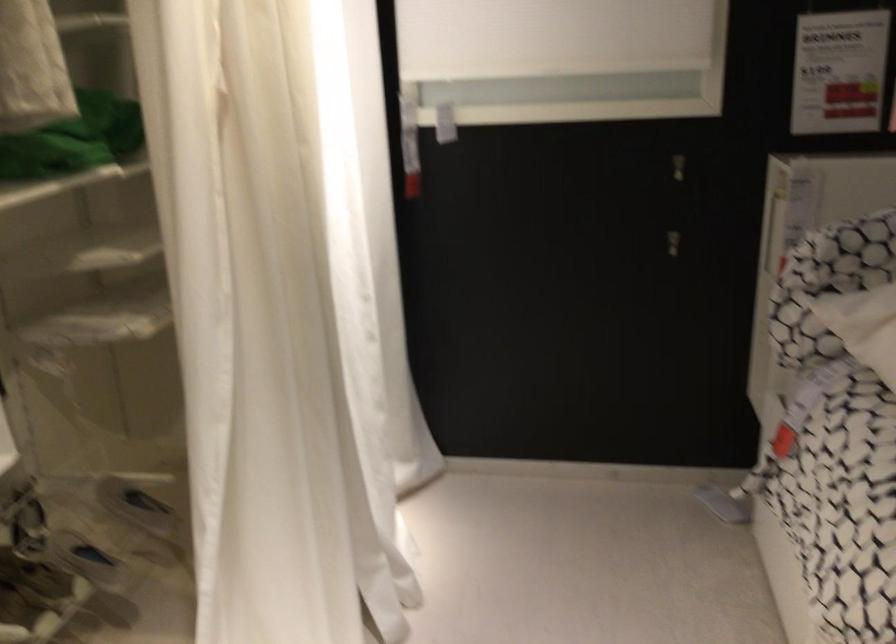
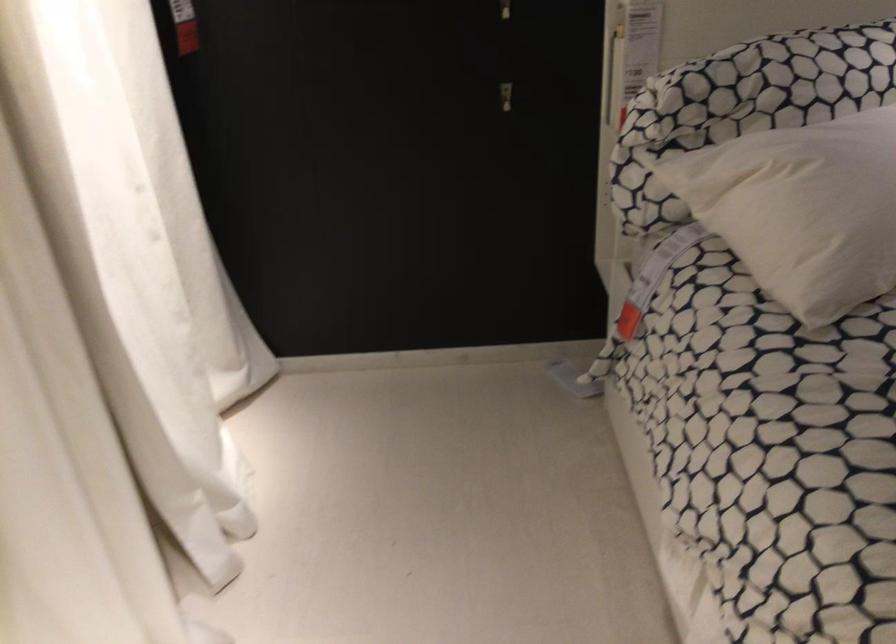
In the second image, find the point that corresponds to point (669, 230) in the first image.

(504, 93)